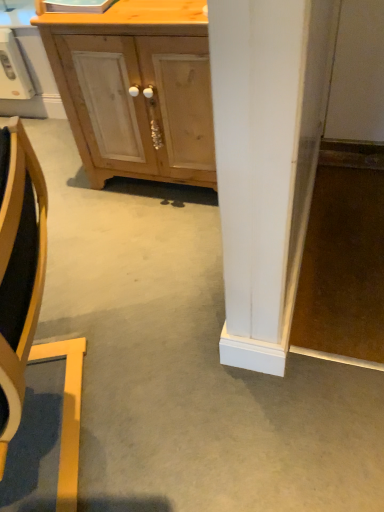
The width and height of the screenshot is (384, 512). In order to click on wooden chair at left in this screenshot , I will do `click(31, 305)`.

This screenshot has height=512, width=384. What are the coordinates of `white plastic microwave at upper left` in the screenshot? It's located at (13, 69).

Is white plastic microwave at upper left not within light wood cabinet at center?

Yes, white plastic microwave at upper left is outside of light wood cabinet at center.

Can you confirm if white plastic microwave at upper left is shorter than light wood cabinet at center?

Correct, white plastic microwave at upper left is not as tall as light wood cabinet at center.

From a real-world perspective, which object stands above the other?

light wood cabinet at center is physically above.

From the image's perspective, is wooden chair at left on light wood cabinet at center?

No, from the image's perspective, wooden chair at left is not above light wood cabinet at center.

Considering the sizes of objects wooden chair at left and light wood cabinet at center in the image provided, who is smaller, wooden chair at left or light wood cabinet at center?

Smaller between the two is light wood cabinet at center.

Does wooden chair at left lie in front of light wood cabinet at center?

Yes, the depth of wooden chair at left is less than that of light wood cabinet at center.

Which object is positioned more to the left, wooden chair at left or white plastic microwave at upper left?

white plastic microwave at upper left.

Is wooden chair at left in front of or behind white plastic microwave at upper left in the image?

In the image, wooden chair at left appears in front of white plastic microwave at upper left.

Considering the sizes of light wood cabinet at center and white plastic microwave at upper left in the image, is light wood cabinet at center taller or shorter than white plastic microwave at upper left?

In the image, light wood cabinet at center appears to be taller than white plastic microwave at upper left.

Does light wood cabinet at center have a greater width compared to white plastic microwave at upper left?

Yes, light wood cabinet at center is wider than white plastic microwave at upper left.

Is light wood cabinet at center inside or outside of white plastic microwave at upper left?

The correct answer is: outside.

The width and height of the screenshot is (384, 512). I want to click on appliance on the left of light wood cabinet at center, so click(13, 69).

Does light wood cabinet at center lie in front of wooden chair at left?

That is False.

Can you see light wood cabinet at center touching wooden chair at left?

No, light wood cabinet at center is not next to wooden chair at left.

How many degrees apart are the facing directions of light wood cabinet at center and wooden chair at left?

The facing directions of light wood cabinet at center and wooden chair at left are 66.6 degrees apart.

Find the location of a particular element. The width and height of the screenshot is (384, 512). cabinetry behind the wooden chair at left is located at coordinates (136, 88).

Is white plastic microwave at upper left facing towards wooden chair at left?

No, white plastic microwave at upper left is not facing towards wooden chair at left.

Which of these two, white plastic microwave at upper left or wooden chair at left, is thinner?

With smaller width is white plastic microwave at upper left.

Is white plastic microwave at upper left at the right side of wooden chair at left?

Incorrect, white plastic microwave at upper left is not on the right side of wooden chair at left.

What are the coordinates of `appliance beneath the light wood cabinet at center (from a real-world perspective)` in the screenshot? It's located at (13, 69).

The width and height of the screenshot is (384, 512). In order to click on chair in front of the light wood cabinet at center in this screenshot , I will do `click(31, 305)`.

Which object lies further to the anchor point light wood cabinet at center, wooden chair at left or white plastic microwave at upper left?

white plastic microwave at upper left is further to light wood cabinet at center.

Looking at this image, which object lies further to the anchor point white plastic microwave at upper left, light wood cabinet at center or wooden chair at left?

wooden chair at left is positioned further to the anchor white plastic microwave at upper left.

Based on their spatial positions, is white plastic microwave at upper left or light wood cabinet at center closer to wooden chair at left?

light wood cabinet at center is positioned closer to the anchor wooden chair at left.

When comparing their distances from white plastic microwave at upper left, does wooden chair at left or light wood cabinet at center seem closer?

light wood cabinet at center is closer to white plastic microwave at upper left.

Considering their positions, is light wood cabinet at center positioned closer to wooden chair at left than white plastic microwave at upper left?

Based on the image, light wood cabinet at center appears to be nearer to wooden chair at left.

When comparing their distances from light wood cabinet at center, does white plastic microwave at upper left or wooden chair at left seem further?

The object further to light wood cabinet at center is white plastic microwave at upper left.

Find the location of a particular element. cabinetry positioned between wooden chair at left and white plastic microwave at upper left from near to far is located at coordinates (136, 88).